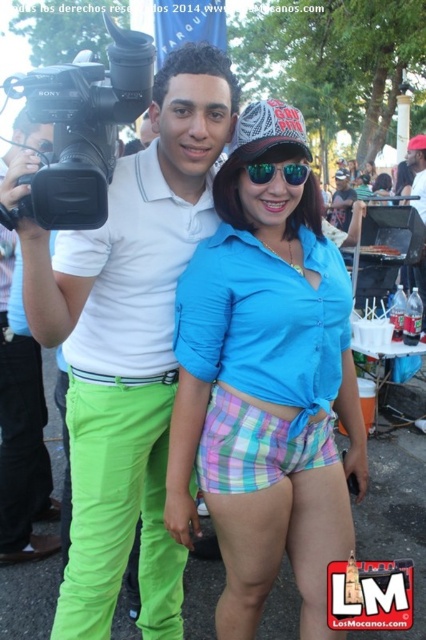
You are a photographer at the event and need to adjust your equipment. You see the matte white polo shirt at center and the black plastic video camera at upper left. Which object is positioned higher in the image?

The black plastic video camera at upper left is positioned higher than the matte white polo shirt at center.

You are a photographer at the event and need to adjust your equipment. Your camera is the black plastic video camera at upper left, and you are wearing the neon green pants at left. How far apart are your camera and your pants?

The black plastic video camera at upper left and the neon green pants at left are 5.82 feet apart from each other.

You are standing at the center of the image. Which direction should you move to reach the point marked at coordinates point [81,128]?

The point marked at coordinates point [81,128] is located on the black plastic video camera at upper left, so you should move to the upper left direction to reach it.